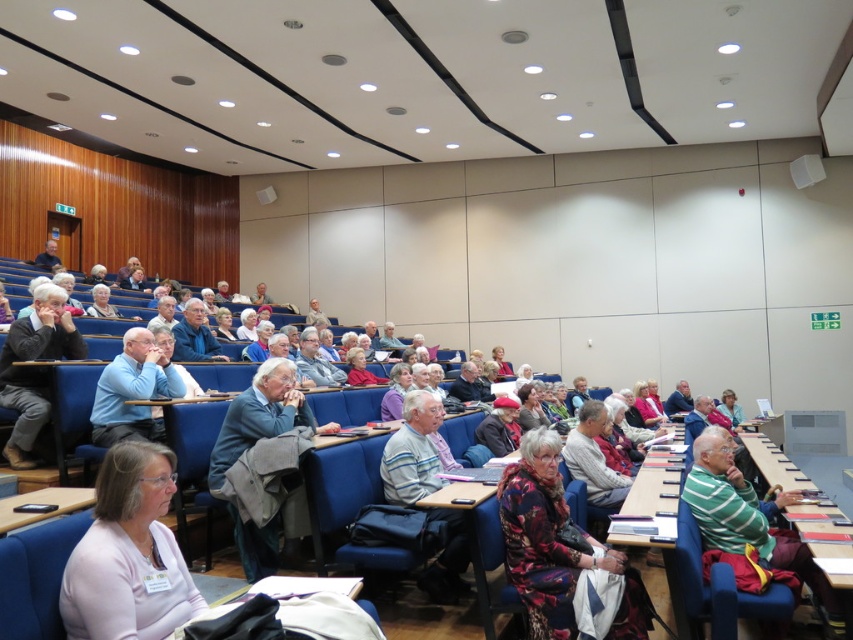
In the scene shown: You are sitting in the front row of the lecture hall and notice a person wearing a light blue shirt at center. Can you determine the exact coordinates of where this person is located in the room?

The light blue shirt at center is located at point (x=132, y=390).

You are an attendee at the lecture hall and want to see the speaker clearly. You notice a floral fabric dress at center and a gray fabric jacket at center. Which one is blocking your view more?

The floral fabric dress at center is in front of the gray fabric jacket at center, so it is blocking your view more.